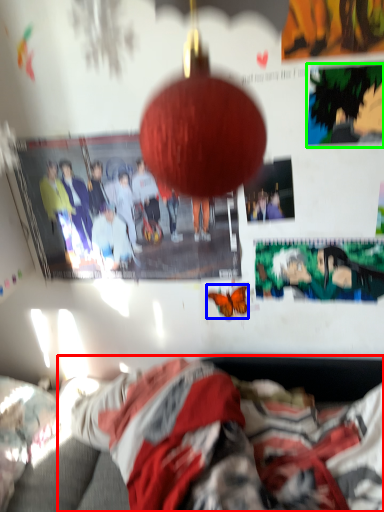
Question: Which is farther away from person (highlighted by a red box)? butterfly (highlighted by a blue box) or poster page (highlighted by a green box)?

Choices:
 (A) butterfly
 (B) poster page

Answer: (B)